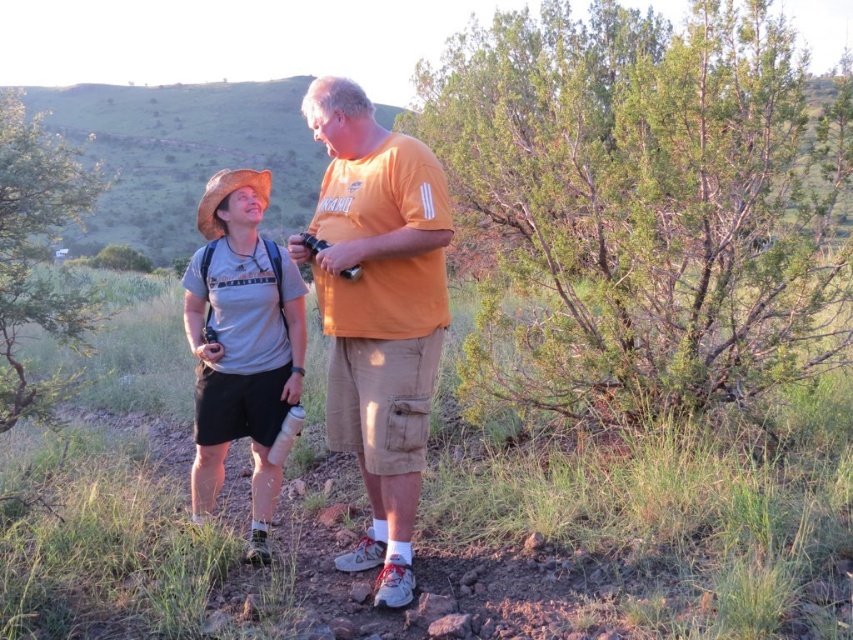
Is orange cotton t-shirt at center to the left of matte gray t-shirt at center from the viewer's perspective?

In fact, orange cotton t-shirt at center is to the right of matte gray t-shirt at center.

Which of these two, orange cotton t-shirt at center or matte gray t-shirt at center, stands taller?

Standing taller between the two is orange cotton t-shirt at center.

Who is more distant from viewer, (415, 157) or (271, 276)?

Point (271, 276)

At what (x,y) coordinates should I click in order to perform the action: click on orange cotton t-shirt at center. Please return your answer as a coordinate pair (x, y). Looking at the image, I should click on (378, 312).